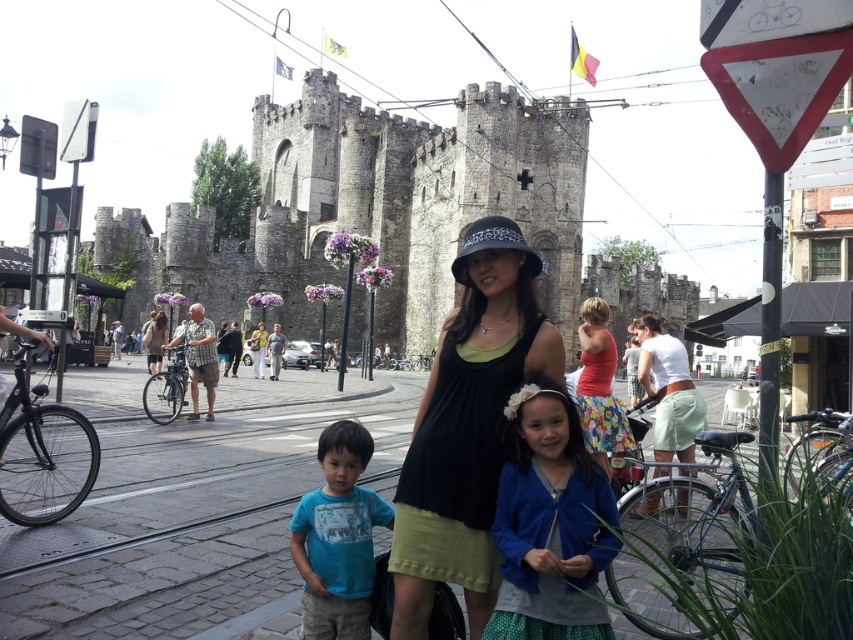
Question: Which of the following is the farthest from the observer?

Choices:
 (A) (497, 364)
 (B) (369, 524)
 (C) (157, 330)
 (D) (534, 502)

Answer: (C)

Question: Can you confirm if gray stone castle at center is smaller than matte black dress at center?

Choices:
 (A) no
 (B) yes

Answer: (A)

Question: Can you confirm if blue cotton shirt at lower left is thinner than floral skirt at center?

Choices:
 (A) yes
 (B) no

Answer: (B)

Question: Which of the following is the farthest from the observer?

Choices:
 (A) (148, 256)
 (B) (358, 580)
 (C) (422, 536)
 (D) (155, 326)

Answer: (A)

Question: Which point appears farthest from the camera in this image?

Choices:
 (A) (160, 349)
 (B) (585, 340)
 (C) (509, 422)
 (D) (126, 316)

Answer: (D)

Question: Can you confirm if floral skirt at center is bigger than matte black dress at center?

Choices:
 (A) no
 (B) yes

Answer: (B)